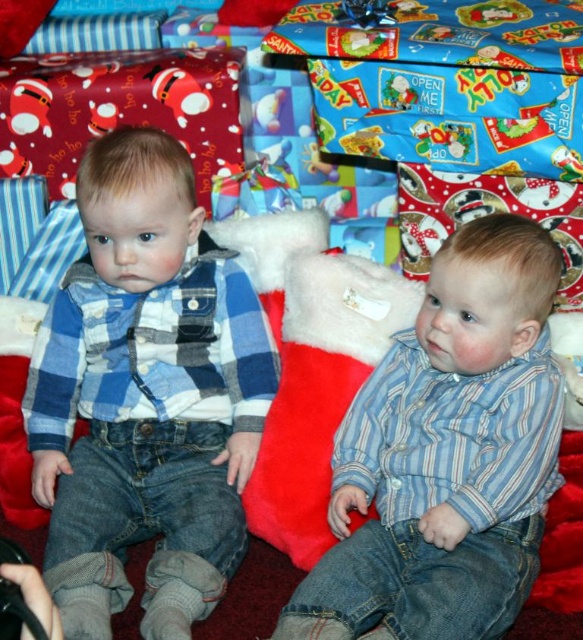
You are a photographer trying to capture a group photo of the children. You need to arrange them so that the child wearing the blue plaid shirt at left is positioned to the right of the child wearing the blue striped shirt at center. Is this possible based on the current arrangement?

The blue plaid shirt at left is currently to the left of the blue striped shirt at center, so to position the blue plaid shirt at left to the right of the blue striped shirt at center, the children would need to swap positions.

You are a photographer trying to capture a group photo of the children. Since you want to ensure that both the blue plaid shirt at left and the blue striped shirt at center are clearly visible, which child should you position closer to the camera to avoid any overlap?

The blue plaid shirt at left is wider than the blue striped shirt at center, so positioning the child wearing the blue plaid shirt at left closer to the camera will help prevent overlap and ensure both shirts are visible.